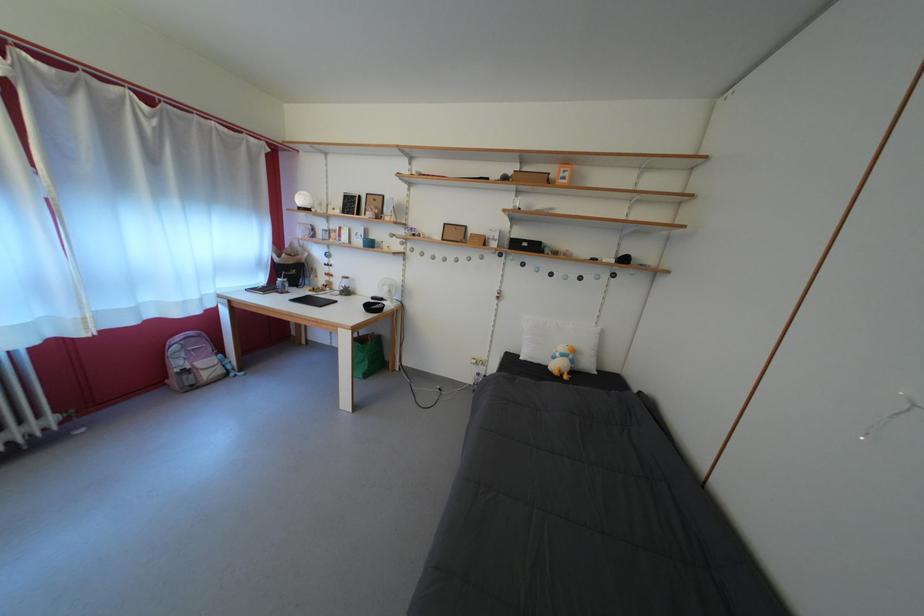
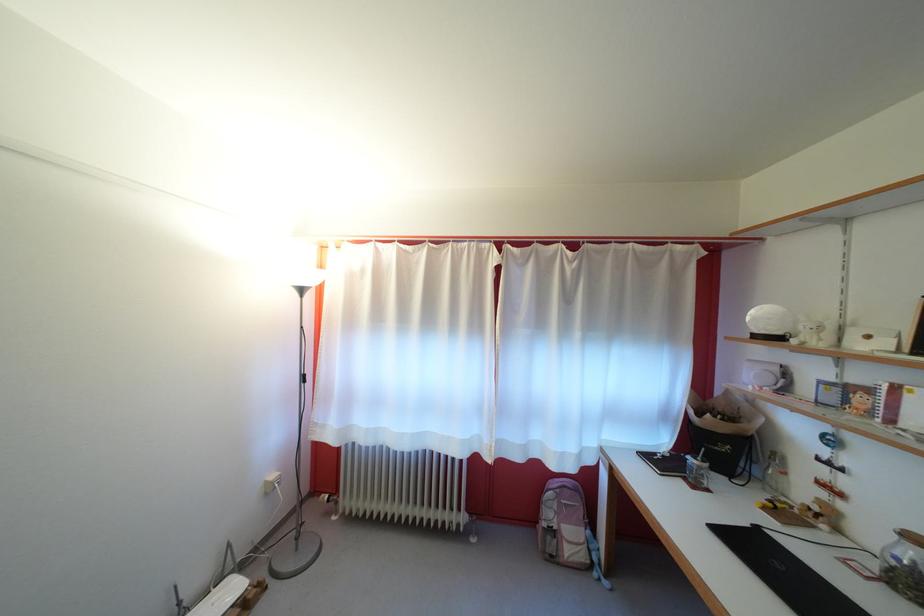
The point at (187, 370) is marked in the first image. Where is the corresponding point in the second image?

(556, 521)